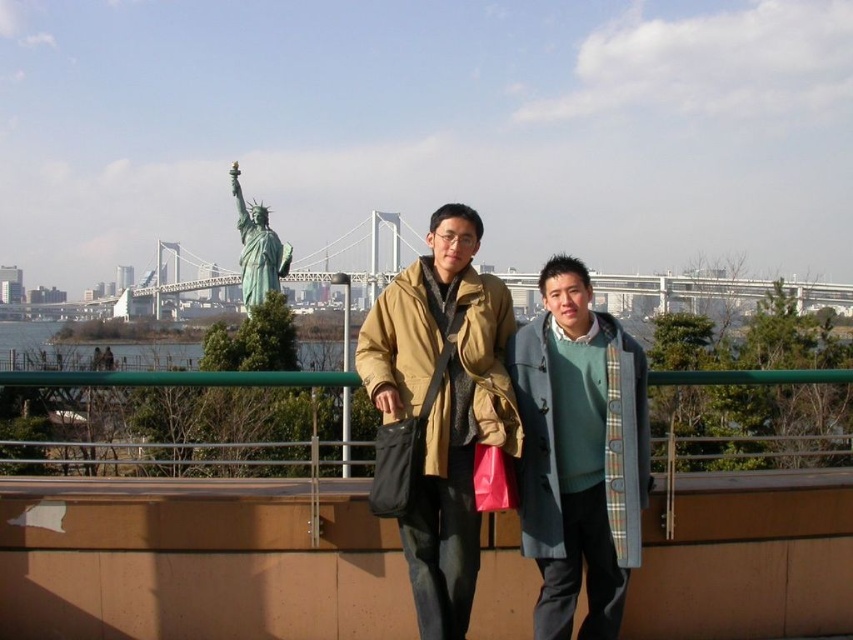
Does matte brown coat at center have a greater width compared to green patina statue at upper center?

Yes, matte brown coat at center is wider than green patina statue at upper center.

Image resolution: width=853 pixels, height=640 pixels. I want to click on matte brown coat at center, so click(x=450, y=404).

Is gray wool coat at center shorter than green patina statue at upper center?

Yes.

The width and height of the screenshot is (853, 640). Describe the element at coordinates (579, 452) in the screenshot. I see `gray wool coat at center` at that location.

Locate an element on the screen. The width and height of the screenshot is (853, 640). gray wool coat at center is located at coordinates (579, 452).

Where is `matte brown coat at center`? This screenshot has height=640, width=853. matte brown coat at center is located at coordinates (450, 404).

Which is more to the right, matte brown coat at center or gray wool coat at center?

Positioned to the right is gray wool coat at center.

Is point (541, 280) positioned before point (614, 486)?

No, it is not.

Locate an element on the screen. The height and width of the screenshot is (640, 853). matte brown coat at center is located at coordinates (450, 404).